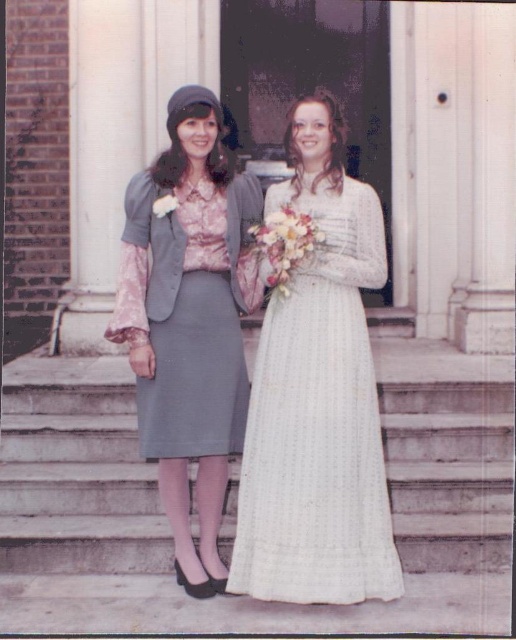
You are an architect designing a new building entrance. You need to place a decorative fountain that must be exactly at the same 2D location as the smooth concrete stairs at center. What coordinates should you use for the fountain?

The smooth concrete stairs at center are located at point [169,531], so the fountain should be placed at the same coordinates, which is [169,531].

You are standing on the steps leading to the building entrance and want to place a small decoration between the two points marked as point (114, 492) and point (358, 304). Which point is closer to you where you should start placing the decoration?

Point (114, 492) is closer to you than point (358, 304), so you should start placing the decoration near point (114, 492).

You are standing at the entrance of the building and want to take a photo of the smooth concrete stairs at center. Where should you position yourself to capture the stairs in the frame?

The smooth concrete stairs at center are located at point 2D coordinates of (169, 531), so you should position yourself directly in front of them to capture them in the frame.